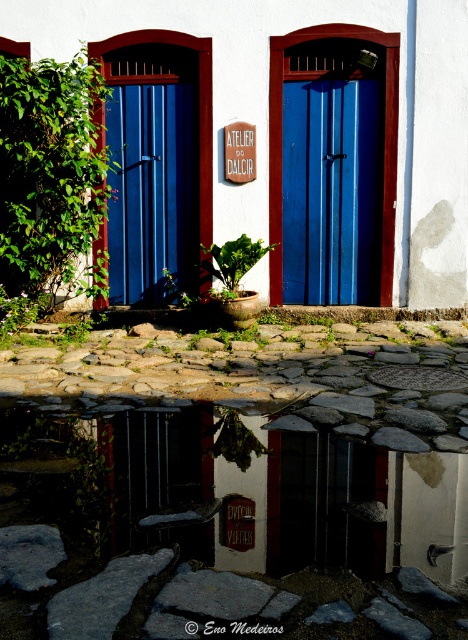
Which is in front, point (22, 97) or point (248, 253)?

Point (22, 97)

This screenshot has width=468, height=640. What do you see at coordinates (51, 176) in the screenshot?
I see `green leafy plant at left` at bounding box center [51, 176].

Where is `green leafy plant at left`? green leafy plant at left is located at coordinates (51, 176).

Based on the photo, is blue painted wood door at center positioned at the back of green matte plant at center?

Yes.

Is point (331, 90) less distant than point (228, 259)?

No, (331, 90) is further to viewer.

Between point (329, 116) and point (241, 237), which one is positioned behind?

Positioned behind is point (329, 116).

This screenshot has width=468, height=640. I want to click on blue painted wood door at center, so click(331, 189).

Can you confirm if blue wooden door at center is positioned above green leafy plant at center?

Yes.

Between point (189, 113) and point (234, 458), which one is positioned behind?

Point (189, 113)

Measure the distance between blue wooden door at center and camera.

7.02 meters

The width and height of the screenshot is (468, 640). What are the coordinates of `blue wooden door at center` in the screenshot? It's located at (147, 188).